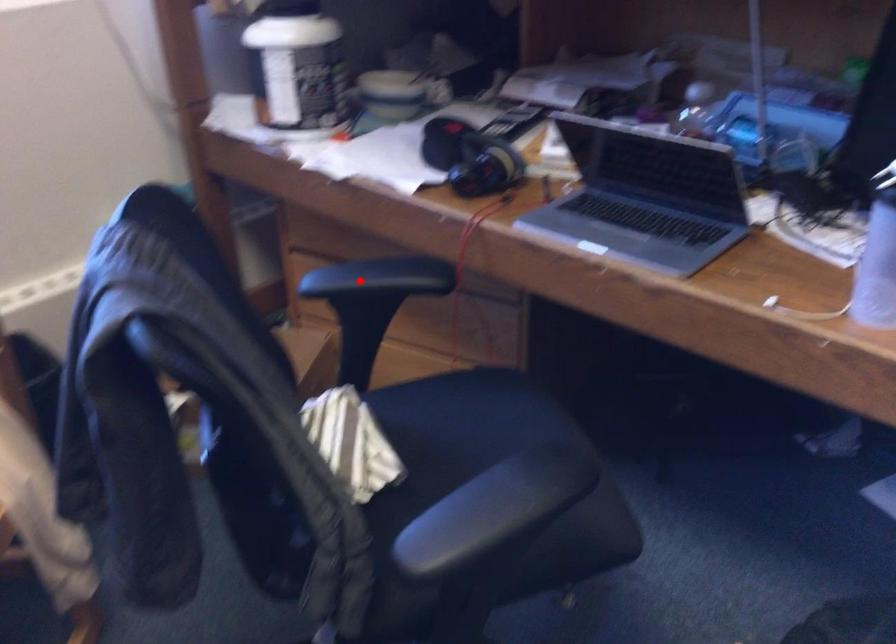
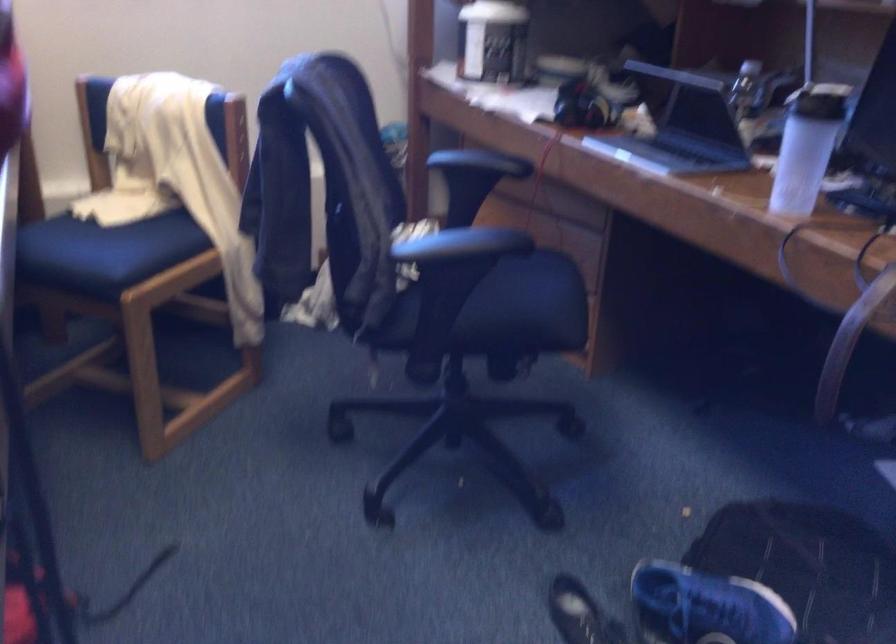
The point at the highlighted location is marked in the first image. Where is the corresponding point in the second image?

(466, 158)